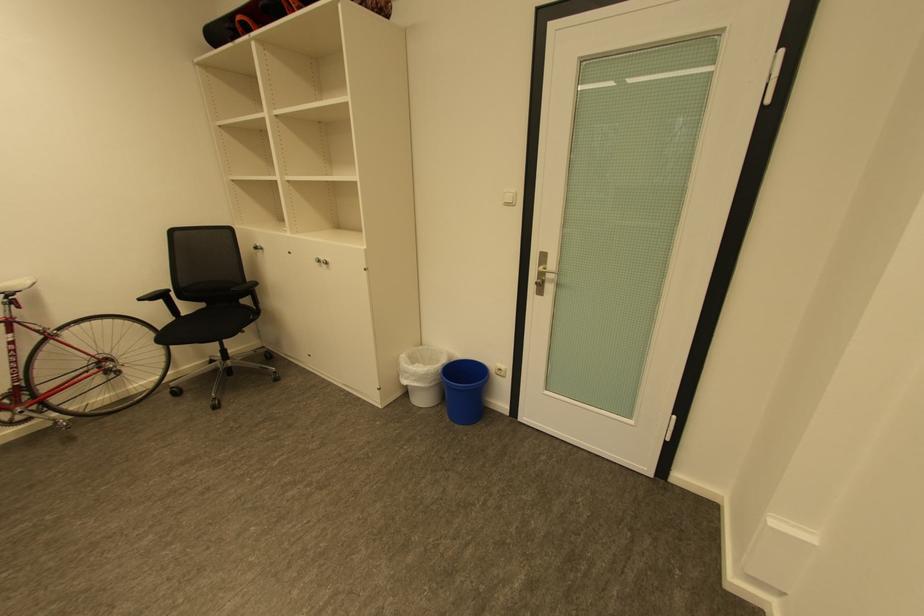
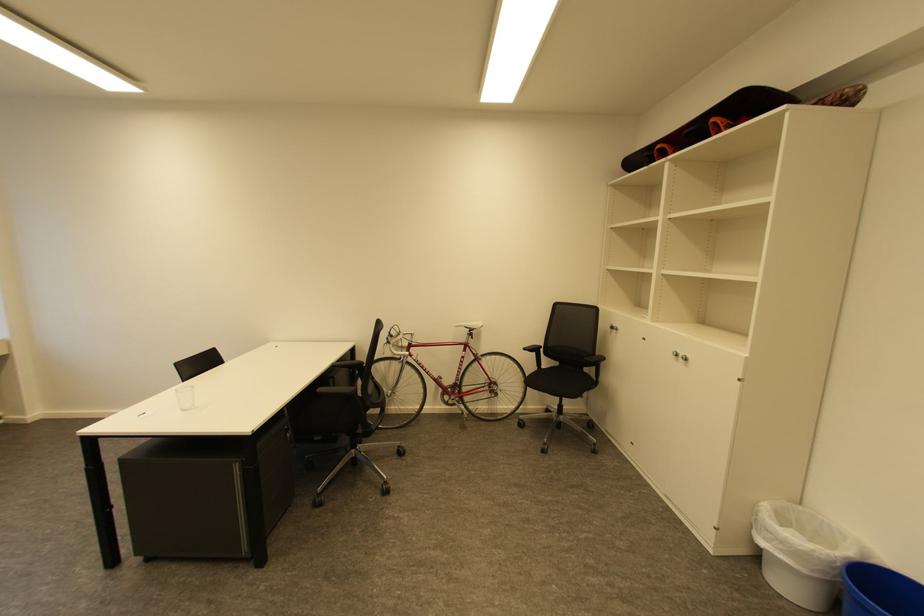
The point at (331, 262) is marked in the first image. Where is the corresponding point in the second image?

(689, 359)